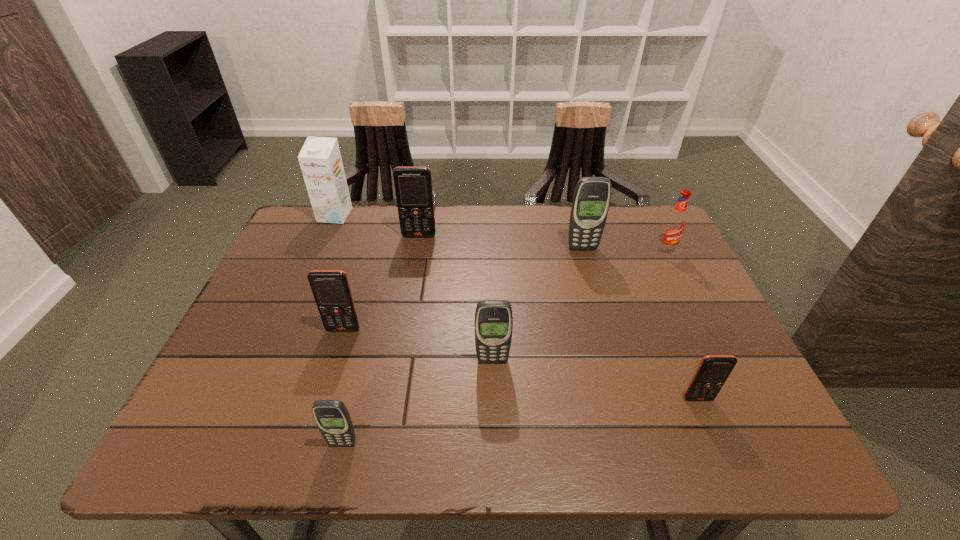
Find the location of a particular element. The image size is (960, 540). free space between the second biggest orange cellular telephone and the fifth farthest cellular telephone is located at coordinates (521, 364).

Locate an element on the screen. free spot between the leftmost gray cellular telephone and the second biggest gray cellular telephone is located at coordinates (418, 402).

The height and width of the screenshot is (540, 960). Identify the location of free space between the second biggest gray cellular telephone and the leftmost gray cellular telephone. (418, 402).

I want to click on free spot between the fourth object from right to left and the nearest object, so click(418, 402).

You are a GUI agent. You are given a task and a screenshot of the screen. Output one action in this format:
    pyautogui.click(x=<x>, y=<y>)
    Task: Click on the second closest object relative to the red root beer
    This screenshot has height=540, width=960.
    Given the screenshot: What is the action you would take?
    pyautogui.click(x=713, y=370)

Identify the location of object that is the closest to the fourth farthest cellular telephone. (331, 289).

The image size is (960, 540). I want to click on the fifth closest cellular telephone to the second smallest orange cellular telephone, so click(713, 370).

Identify which cellular telephone is located as the second nearest to the second biggest gray cellular telephone. Please provide its 2D coordinates. Your answer should be formatted as a tuple, i.e. [(x, y)], where the tuple contains the x and y coordinates of a point satisfying the conditions above.

[(333, 420)]

Find the location of a particular element. The image size is (960, 540). orange cellular telephone identified as the third closest to the root beer is located at coordinates (331, 289).

Locate which orange cellular telephone is the second closest to the root beer. Please provide its 2D coordinates. Your answer should be formatted as a tuple, i.e. [(x, y)], where the tuple contains the x and y coordinates of a point satisfying the conditions above.

[(413, 185)]